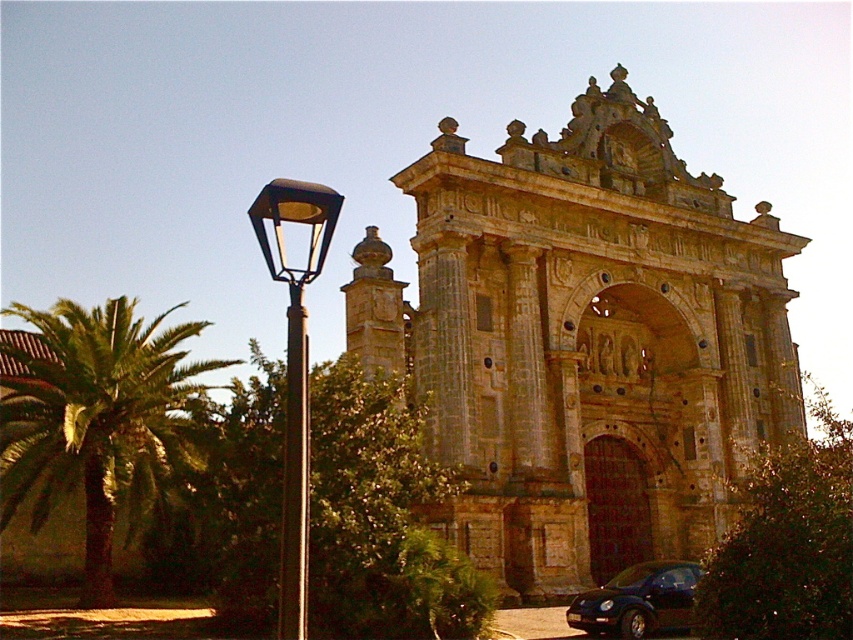
Based on the photo, you are standing in front of the grand stone archway and want to walk from point A to point B. Point A is located at coordinate point (454,268) and point B is at coordinate point (648,580). Given the spatial relationship between these two points, which direction should you move to reach point B from point A?

Point (454,268) is behind point (648,580). To reach point B from point A, you should move forward towards point B since point A is behind point B.

You are standing in front of the grand archway and want to take a photo of the shiny black car at lower right without the green leafy palm at left blocking it. Which direction should you move to ensure the palm is no longer in the frame?

The green leafy palm at left is positioned over the shiny black car at lower right. To avoid the palm blocking the car, move to the right side of the archway so the palm moves out of the frame.